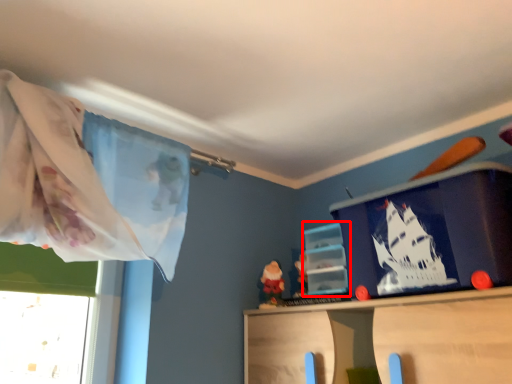
Question: From the image's perspective, considering the relative positions of shelf (annotated by the red box) and window screen in the image provided, where is shelf (annotated by the red box) located with respect to the staircase?

Choices:
 (A) above
 (B) below

Answer: (B)